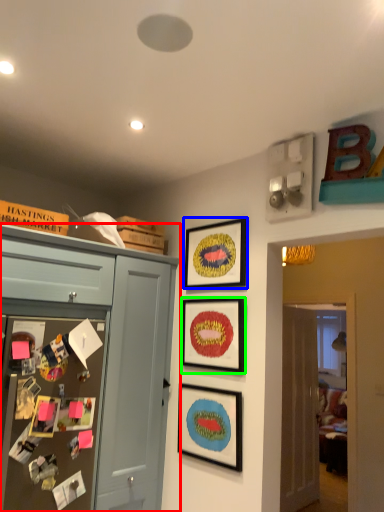
Question: Estimate the real-world distances between objects in this image. Which object is closer to cabinetry (highlighted by a red box), picture frame (highlighted by a blue box) or picture frame (highlighted by a green box)?

Choices:
 (A) picture frame
 (B) picture frame

Answer: (B)